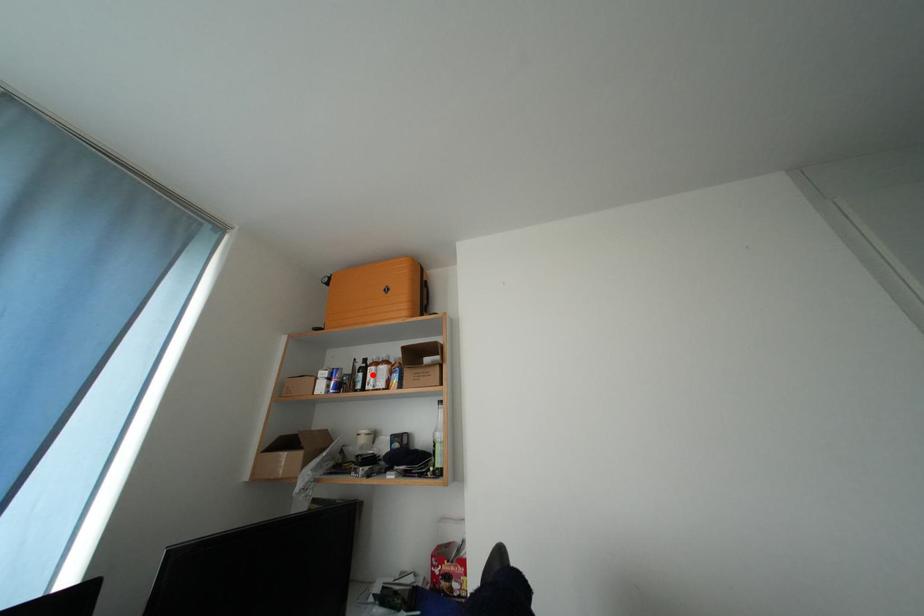
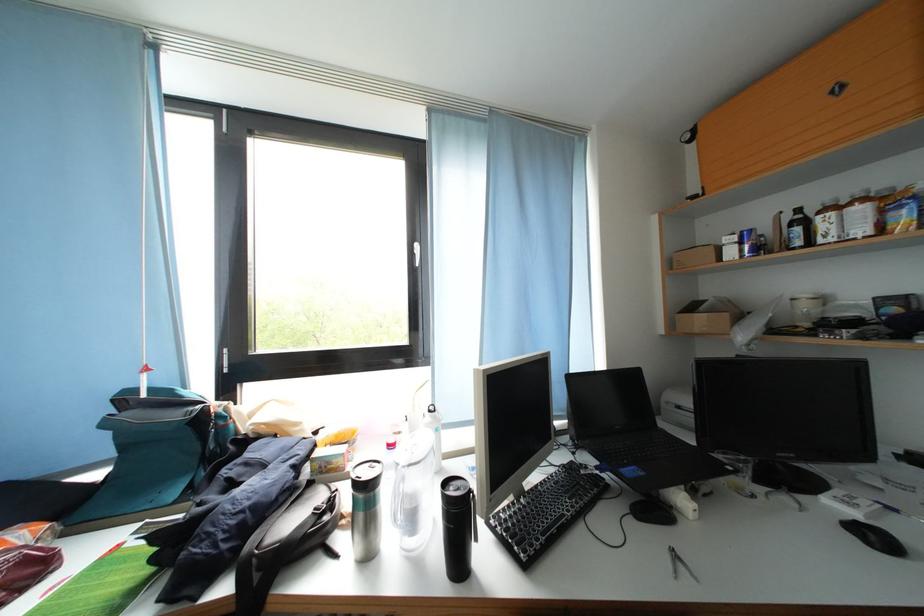
Where in the second image is the point corresponding to the highlighted location from the first image?

(812, 227)